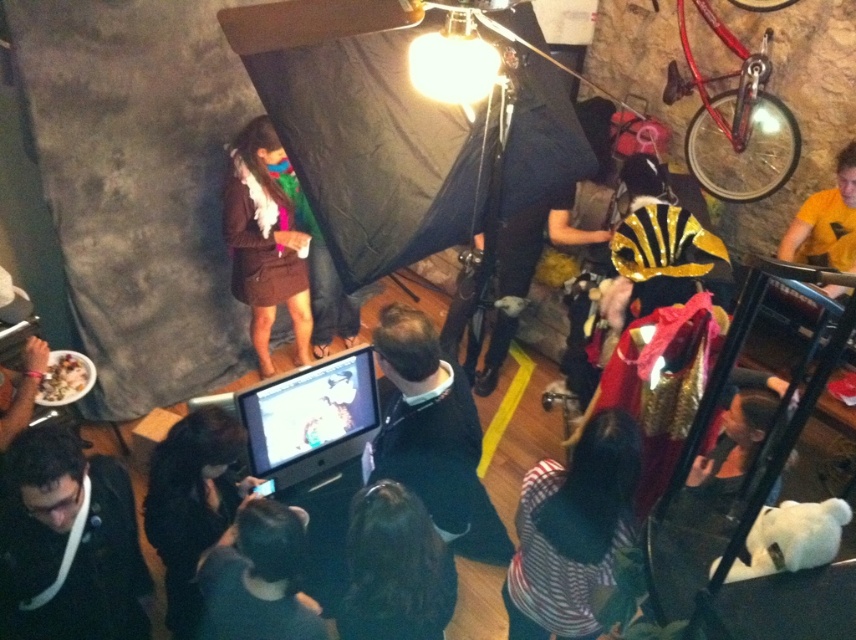
Does gold metallic mask at lower right come behind white matte bowl at center?

No, gold metallic mask at lower right is in front of white matte bowl at center.

Is point (752, 420) less distant than point (78, 381)?

Yes, point (752, 420) is in front of point (78, 381).

Locate an element on the screen. This screenshot has height=640, width=856. gold metallic mask at lower right is located at coordinates (736, 440).

Does striped fabric dress at lower center appear on the left side of gold metallic mask at lower right?

Indeed, striped fabric dress at lower center is positioned on the left side of gold metallic mask at lower right.

Between striped fabric dress at lower center and gold metallic mask at lower right, which one is positioned lower?

Positioned lower is striped fabric dress at lower center.

Is point (535, 620) positioned behind point (694, 476)?

That is True.

You are a GUI agent. You are given a task and a screenshot of the screen. Output one action in this format:
    pyautogui.click(x=<x>, y=<y>)
    Task: Click on the striped fabric dress at lower center
    This screenshot has height=640, width=856.
    Given the screenshot: What is the action you would take?
    pyautogui.click(x=572, y=532)

What do you see at coordinates (572, 532) in the screenshot? I see `striped fabric dress at lower center` at bounding box center [572, 532].

Between striped fabric dress at lower center and yellow matte shirt at upper right, which one has less height?

yellow matte shirt at upper right

Between point (569, 608) and point (841, 163), which one is positioned in front?

Positioned in front is point (569, 608).

Locate an element on the screen. This screenshot has height=640, width=856. striped fabric dress at lower center is located at coordinates (572, 532).